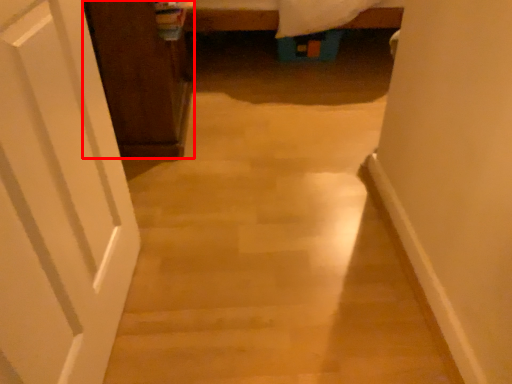
Question: From the image's perspective, where is cabinetry (annotated by the red box) located relative to door?

Choices:
 (A) below
 (B) above

Answer: (B)